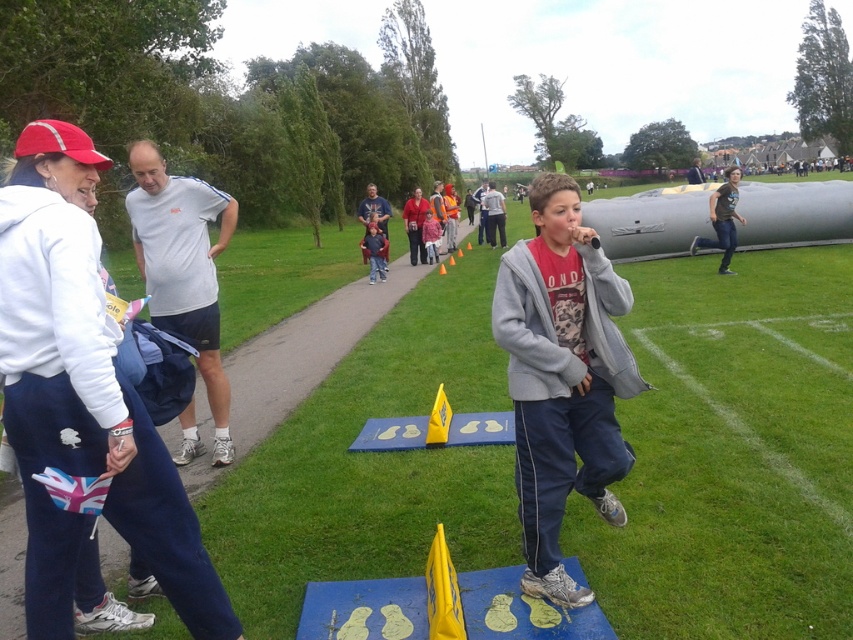
You are standing at point (x=96, y=620) and want to walk to the microphone holder. The microphone holder is located at point (x=550, y=476). Is the microphone holder in front of you or behind you?

The microphone holder at point (x=550, y=476) is in front of you because it is in front of point (x=96, y=620) where you are standing.

You are a photographer standing at the edge of the grassy field. You want to take a photo of the white fleece jacket at upper left without including the concrete sidewalk at center in the frame. Is this possible based on their positions?

The white fleece jacket at upper left is behind the concrete sidewalk at center, so it would be blocked from view. Therefore, you cannot take a photo of the white fleece jacket at upper left without the concrete sidewalk at center appearing in the frame.